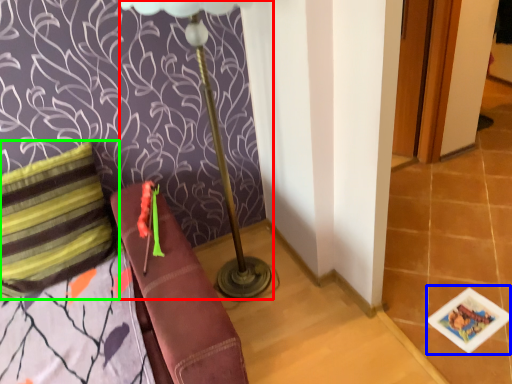
Question: Which object is positioned farthest from table lamp (highlighted by a red box)? Select from card game (highlighted by a blue box) and pillow (highlighted by a green box).

Choices:
 (A) card game
 (B) pillow

Answer: (A)